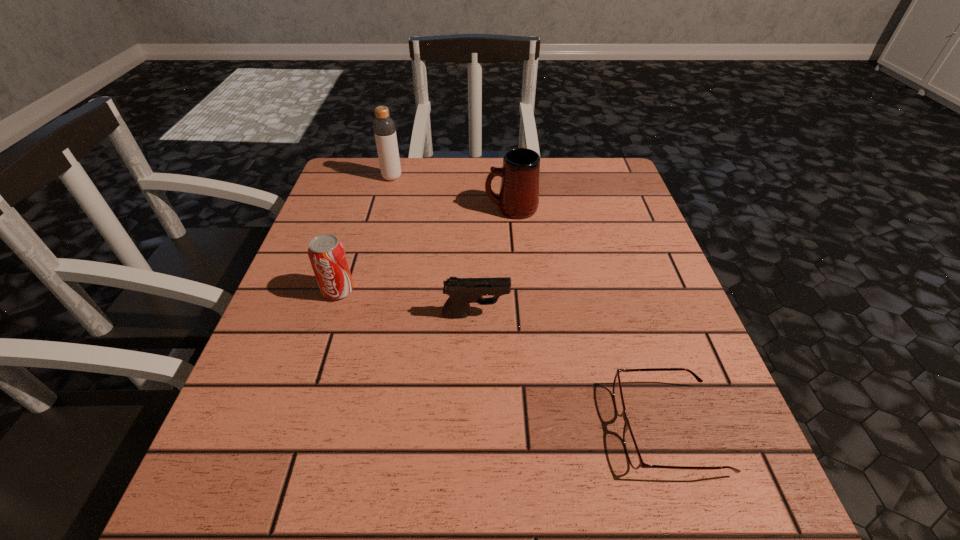
Locate an element on the screen. This screenshot has height=540, width=960. free space at the near right corner of the desktop is located at coordinates (694, 498).

The image size is (960, 540). I want to click on blank region between the soda can and the shortest object, so click(503, 359).

Identify the location of free spot between the third nearest object and the shortest object. Image resolution: width=960 pixels, height=540 pixels. (503, 359).

Locate an element on the screen. free space between the pistol and the nearest object is located at coordinates (571, 371).

Where is `empty space between the tallest object and the third farthest object`? The width and height of the screenshot is (960, 540). empty space between the tallest object and the third farthest object is located at coordinates click(x=365, y=234).

Locate an element on the screen. vacant area that lies between the third farthest object and the tallest object is located at coordinates (365, 234).

The image size is (960, 540). What are the coordinates of `empty location between the tallest object and the nearest object` in the screenshot? It's located at (530, 302).

Find the location of a particular element. This screenshot has width=960, height=540. vacant space that is in between the spectacles and the second farthest object is located at coordinates point(589,318).

Locate an element on the screen. The width and height of the screenshot is (960, 540). vacant space in between the pistol and the spectacles is located at coordinates (571, 371).

Where is `blank region between the nearest object and the mug`? This screenshot has height=540, width=960. blank region between the nearest object and the mug is located at coordinates (589, 318).